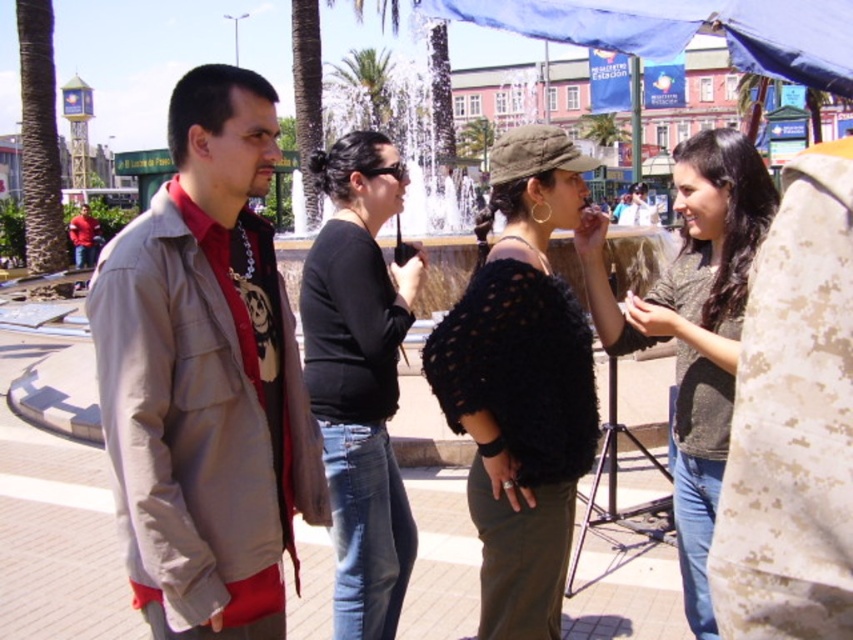
Question: Which of the following is the closest to the observer?

Choices:
 (A) matte red shirt at left
 (B) matte khaki jacket at left

Answer: (B)

Question: Is the position of blue tarpaulin at upper center more distant than that of green leafy palm tree at upper center?

Choices:
 (A) yes
 (B) no

Answer: (B)

Question: Which object is the farthest from the black knitted sweater at center?

Choices:
 (A) blue tarpaulin at upper center
 (B) matte red shirt at left
 (C) green leafy palm tree at upper center

Answer: (C)

Question: Which point appears farthest from the camera in this image?

Choices:
 (A) (84, 262)
 (B) (364, 88)
 (C) (384, 550)

Answer: (B)

Question: Is knitted sweater at center bigger than matte red shirt at left?

Choices:
 (A) no
 (B) yes

Answer: (B)

Question: From the image, what is the correct spatial relationship of black knitted sweater at center in relation to knitted sweater at center?

Choices:
 (A) right
 (B) left

Answer: (B)